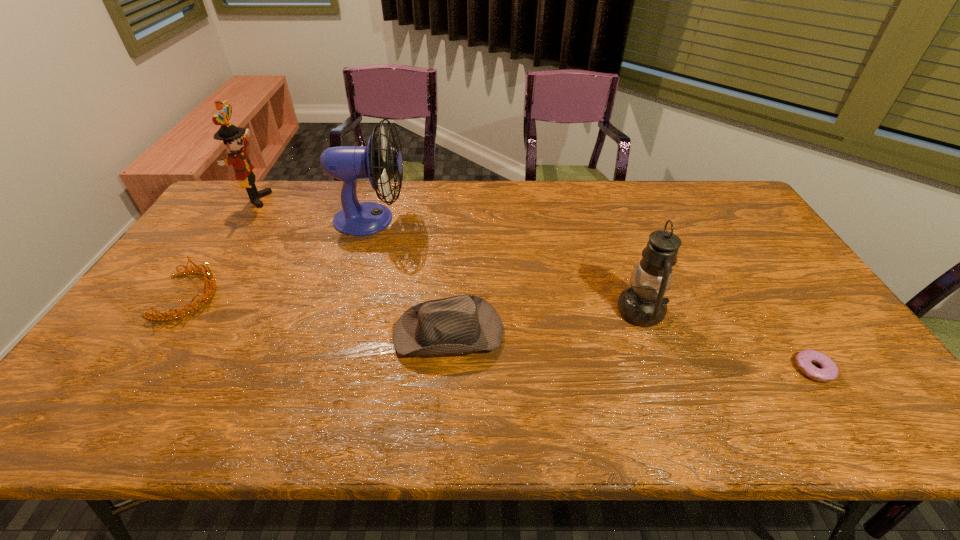
Where is `nutcracker`? The image size is (960, 540). nutcracker is located at coordinates (231, 135).

This screenshot has height=540, width=960. Identify the location of fan. (346, 163).

Where is `the third tallest object`? The image size is (960, 540). the third tallest object is located at coordinates (642, 304).

Locate an element on the screen. The height and width of the screenshot is (540, 960). oil lamp is located at coordinates (642, 304).

What are the coordinates of `the fourth object from left to right` in the screenshot? It's located at (462, 324).

This screenshot has height=540, width=960. Find the location of `the fourth tallest object`. the fourth tallest object is located at coordinates (462, 324).

Locate an element on the screen. the fifth tallest object is located at coordinates (208, 273).

Where is `doughnut`? Image resolution: width=960 pixels, height=540 pixels. doughnut is located at coordinates (829, 371).

Where is `the shortest object`? The image size is (960, 540). the shortest object is located at coordinates (829, 371).

Locate an element on the screen. This screenshot has width=960, height=540. blank space located 0.160m on the front-facing side of the nutcracker is located at coordinates (313, 199).